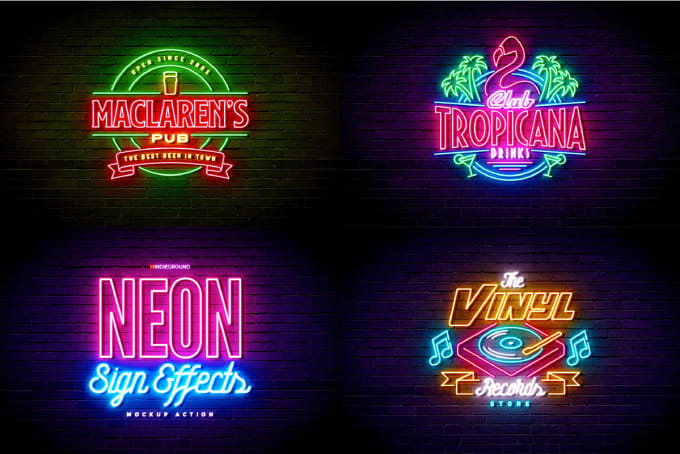
This screenshot has width=680, height=454. I want to click on black wall background, so [x=334, y=207].